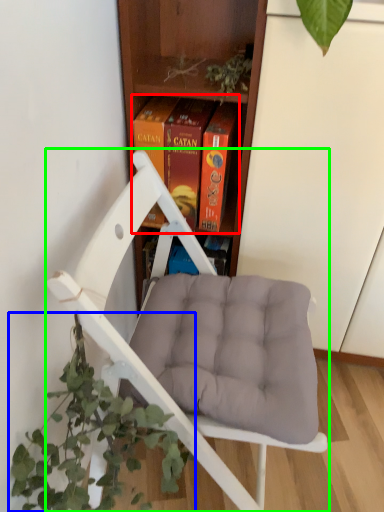
Question: Which is farther away from book (highlighted by a red box)? houseplant (highlighted by a blue box) or chair (highlighted by a green box)?

Choices:
 (A) houseplant
 (B) chair

Answer: (A)